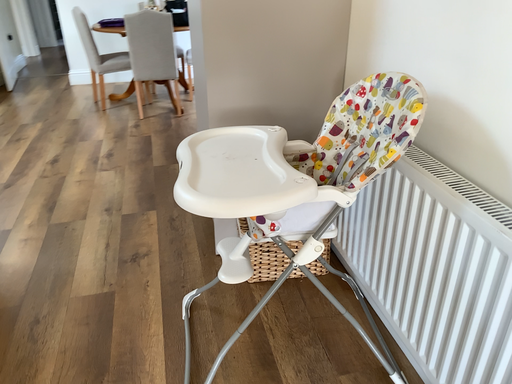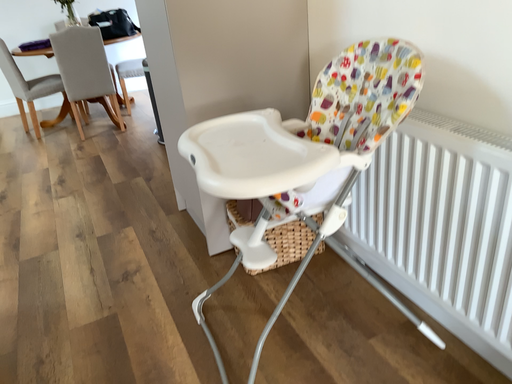
Question: Which way did the camera rotate in the video?

Choices:
 (A) rotated right
 (B) rotated left

Answer: (A)